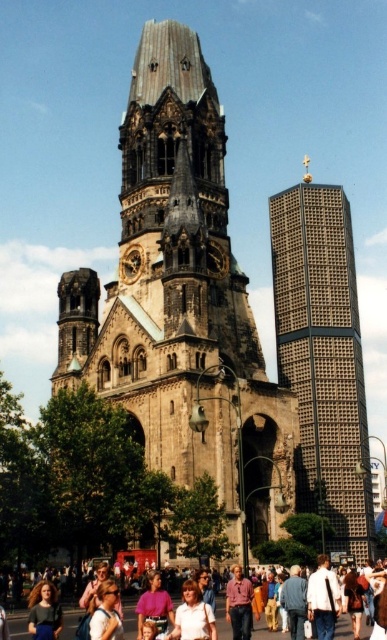
You are a photographer planning to capture both the gray textured skyscraper at right and the blonde hair at center in a single shot. Since you want to emphasize the height difference between them, which object should you position closer to the bottom of the frame to achieve this effect?

To emphasize the height difference, position the blonde hair at center closer to the bottom of the frame since the gray textured skyscraper at right is taller and would naturally occupy more vertical space in the composition.

You are a photographer standing in front of the historic church and modern skyscraper. You want to take a photo that includes both the white cotton shirt at center and the blonde hair at center. Which object should you focus on first if you want to ensure both are in the frame?

The white cotton shirt at center is much taller than the blonde hair at center, so you should focus on the white cotton shirt at center first to ensure both are in the frame.